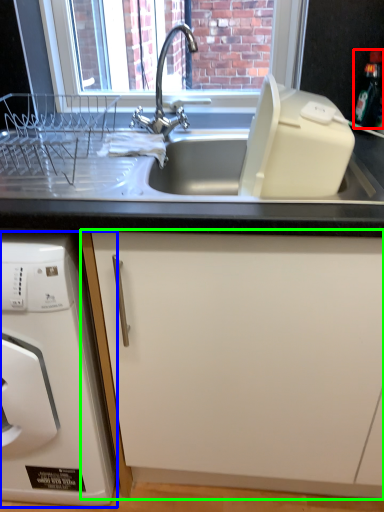
Question: Based on their relative distances, which object is nearer to bottle (highlighted by a red box)? Choose from home appliance (highlighted by a blue box) and cabinetry (highlighted by a green box).

Choices:
 (A) home appliance
 (B) cabinetry

Answer: (B)